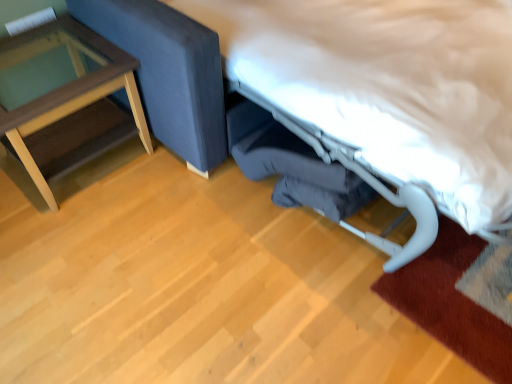
Question: Is transparent glass table at left bigger or smaller than white fabric bed at center?

Choices:
 (A) big
 (B) small

Answer: (B)

Question: Is transparent glass table at left inside the boundaries of white fabric bed at center, or outside?

Choices:
 (A) outside
 (B) inside

Answer: (A)

Question: Considering the positions of point (72, 94) and point (403, 160), is point (72, 94) closer or farther from the camera than point (403, 160)?

Choices:
 (A) closer
 (B) farther

Answer: (B)

Question: Would you say white fabric bed at center is to the left or to the right of transparent glass table at left in the picture?

Choices:
 (A) left
 (B) right

Answer: (B)

Question: Considering the positions of white fabric bed at center and transparent glass table at left in the image, is white fabric bed at center bigger or smaller than transparent glass table at left?

Choices:
 (A) big
 (B) small

Answer: (A)

Question: Is point (470, 155) positioned closer to the camera than point (67, 29)?

Choices:
 (A) closer
 (B) farther

Answer: (A)

Question: Is white fabric bed at center in front of or behind transparent glass table at left in the image?

Choices:
 (A) front
 (B) behind

Answer: (A)